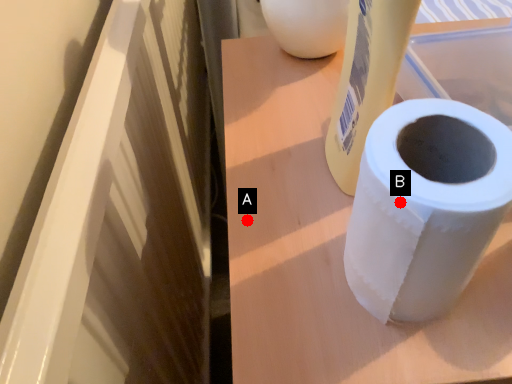
Question: Two points are circled on the image, labeled by A and B beside each circle. Which point is further to the camera?

Choices:
 (A) A is further
 (B) B is further

Answer: (A)